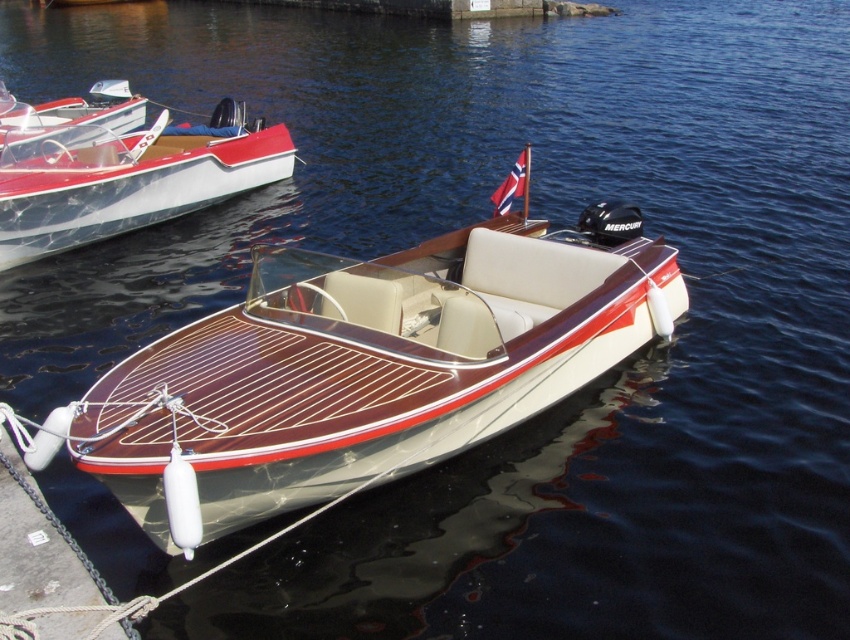
Is wooden boat at center bigger than shiny white boat at left?

Yes.

At what (x,y) coordinates should I click in order to perform the action: click on wooden boat at center. Please return your answer as a coordinate pair (x, y). Looking at the image, I should click on (363, 369).

Between wooden boat at center and shiny metallic boat at upper left, which one is positioned lower?

wooden boat at center is below.

Describe the element at coordinates (363, 369) in the screenshot. I see `wooden boat at center` at that location.

The height and width of the screenshot is (640, 850). In order to click on wooden boat at center in this screenshot , I will do `click(363, 369)`.

Between shiny white boat at left and shiny metallic boat at upper left, which one is positioned higher?

Positioned higher is shiny metallic boat at upper left.

Does shiny white boat at left have a lesser height compared to shiny metallic boat at upper left?

No, shiny white boat at left is not shorter than shiny metallic boat at upper left.

This screenshot has width=850, height=640. I want to click on shiny white boat at left, so click(128, 177).